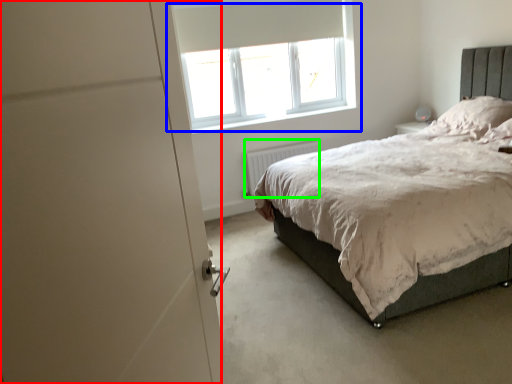
Question: Which object is positioned closest to screen door (highlighted by a red box)? Select from window (highlighted by a blue box) and radiator (highlighted by a green box).

Choices:
 (A) window
 (B) radiator

Answer: (B)